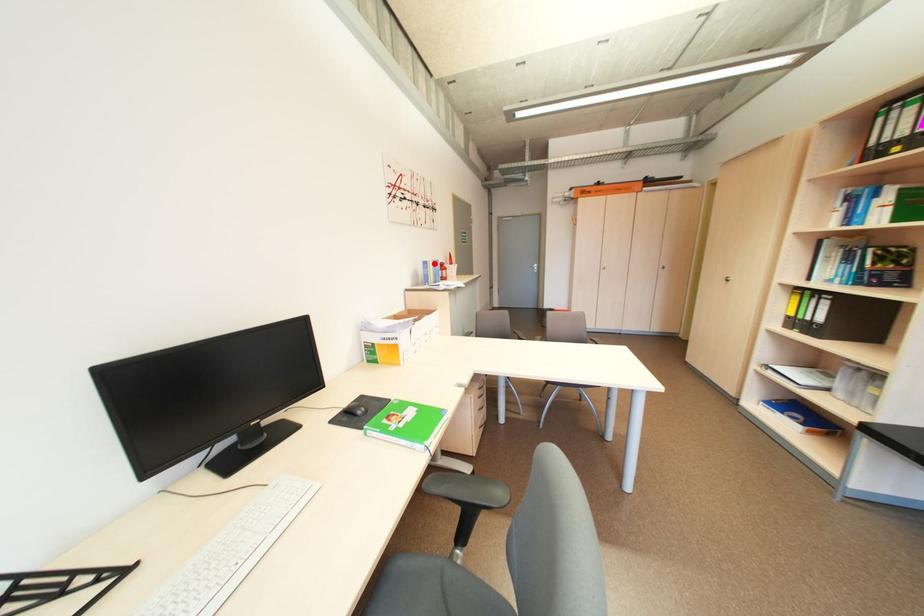
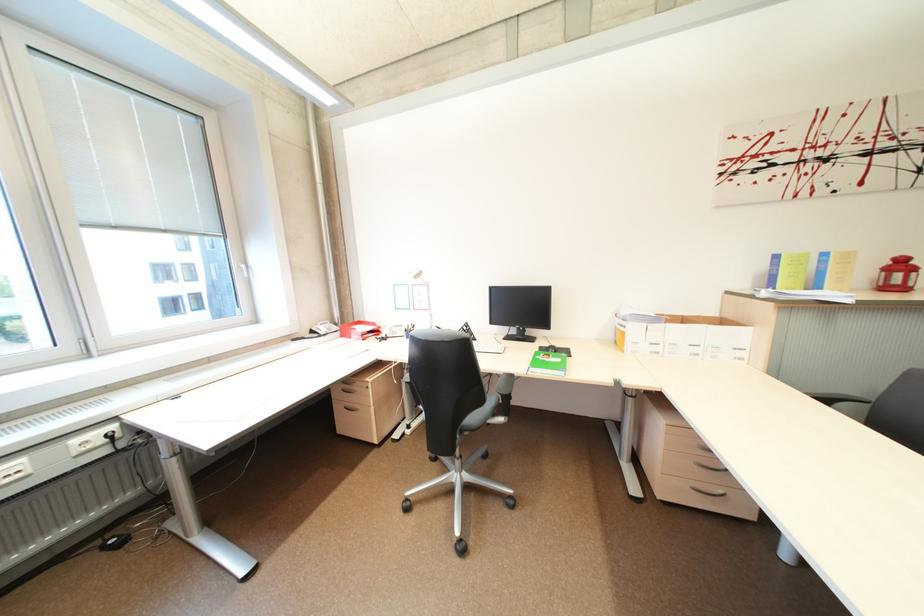
Question: A red point is marked in image1. In image2, is the corresponding 3D point closer to the camera or farther? Reply with the corresponding letter.

Choices:
 (A) The corresponding 3D point is closer.
 (B) The corresponding 3D point is farther.

Answer: (B)